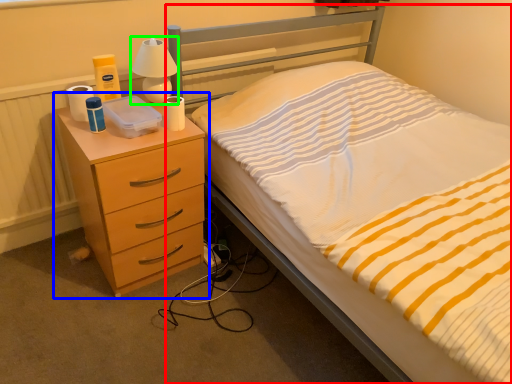
Question: Estimate the real-world distances between objects in this image. Which object is closer to bed (highlighted by a red box), chest of drawers (highlighted by a blue box) or bedside lamp (highlighted by a green box)?

Choices:
 (A) chest of drawers
 (B) bedside lamp

Answer: (A)